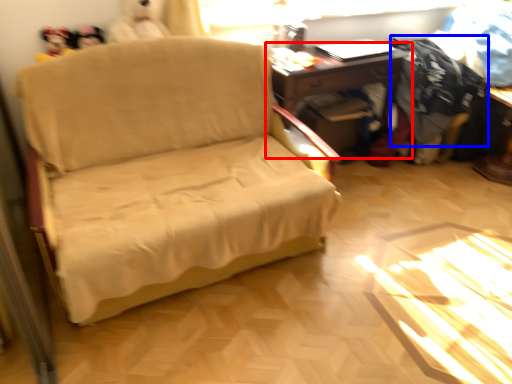
Question: Which of the following is the farthest to the observer, table (highlighted by a red box) or clothing (highlighted by a blue box)?

Choices:
 (A) table
 (B) clothing

Answer: (B)